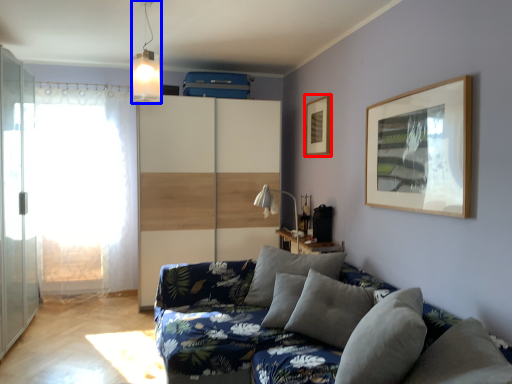
Question: Which of the following is the closest to the observer, picture frame (highlighted by a red box) or light fixture (highlighted by a blue box)?

Choices:
 (A) picture frame
 (B) light fixture

Answer: (B)